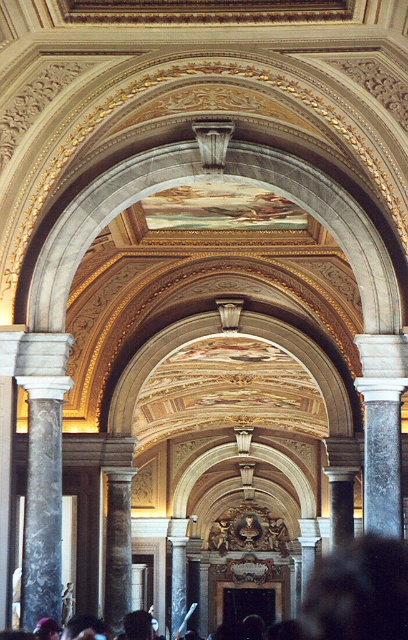
You are standing in the grand architectural space and want to take a photo. There are two points of interest marked as point (42, 340) and point (184, 520). Which point is closer to you when you look through the camera viewfinder?

Point (42, 340) is closer to the camera than point (184, 520), so it will appear nearer in the photo.

You are standing in the grand architectural space and notice a point labeled at coordinates [359,593]. Based on the scene description, what is located at that point?

The point at coordinates [359,593] indicates dark hair at center.